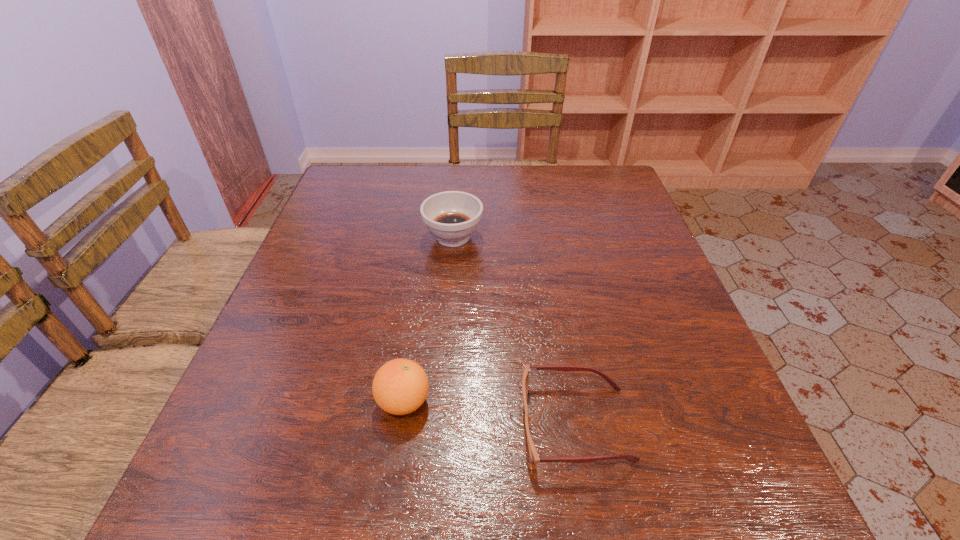
The width and height of the screenshot is (960, 540). I want to click on free space that satisfies the following two spatial constraints: 1. on the back side of the orange; 2. on the right side of the farthest object, so click(x=428, y=237).